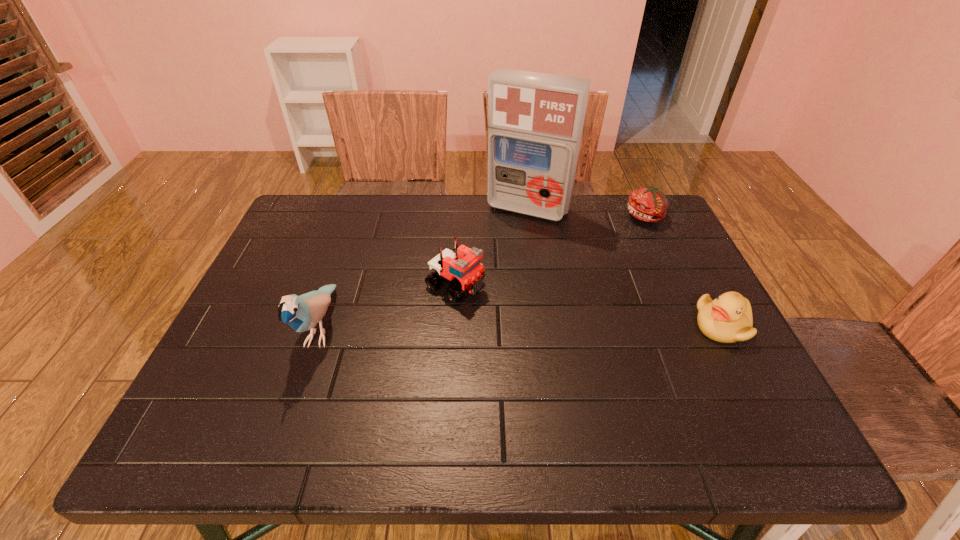
The width and height of the screenshot is (960, 540). What are the coordinates of `tomato at the far edge` in the screenshot? It's located at (648, 204).

Locate an element on the screen. Image resolution: width=960 pixels, height=540 pixels. the first-aid kit located in the far edge section of the desktop is located at coordinates (535, 120).

The image size is (960, 540). I want to click on object located in the near edge section of the desktop, so click(302, 313).

The width and height of the screenshot is (960, 540). I want to click on duckling situated at the right edge, so click(x=727, y=319).

Find the location of `tomato located in the right edge section of the desktop`. tomato located in the right edge section of the desktop is located at coordinates [x=648, y=204].

Where is `object at the far right corner`? Image resolution: width=960 pixels, height=540 pixels. object at the far right corner is located at coordinates (648, 204).

Identify the location of vacant space at the far edge. (549, 226).

This screenshot has height=540, width=960. What are the coordinates of `vacant space at the near edge of the desktop` in the screenshot? It's located at (623, 383).

Find the location of a particular element. This screenshot has height=540, width=960. free space at the left edge of the desktop is located at coordinates (275, 353).

Locate an element on the screen. This screenshot has height=540, width=960. vacant space at the right edge of the desktop is located at coordinates (661, 299).